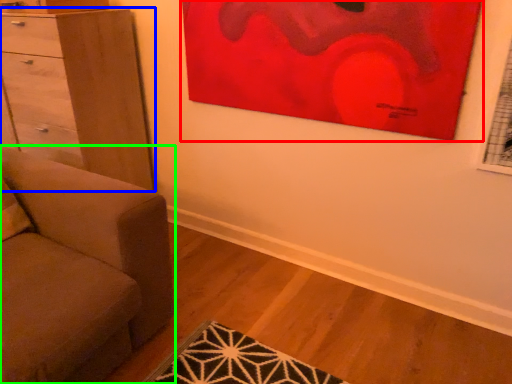
Question: Considering the real-world distances, which object is closest to picture frame (highlighted by a red box)? chest of drawers (highlighted by a blue box) or studio couch (highlighted by a green box).

Choices:
 (A) chest of drawers
 (B) studio couch

Answer: (A)